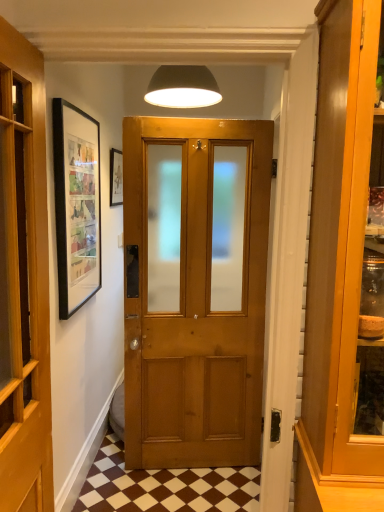
Question: Visually, is matte black lampshade at upper center positioned to the left or to the right of matte black picture frame at upper left?

Choices:
 (A) left
 (B) right

Answer: (B)

Question: Based on their sizes in the image, would you say matte black lampshade at upper center is bigger or smaller than matte black picture frame at upper left?

Choices:
 (A) big
 (B) small

Answer: (A)

Question: Considering the real-world distances, which object is farthest from the matte black picture frame at upper left?

Choices:
 (A) wooden door at center
 (B) brown checkered tile at lower center
 (C) matte black lampshade at upper center

Answer: (B)

Question: Which is farther from the wooden door at center?

Choices:
 (A) brown checkered tile at lower center
 (B) matte black lampshade at upper center
 (C) matte black picture frame at upper left

Answer: (C)